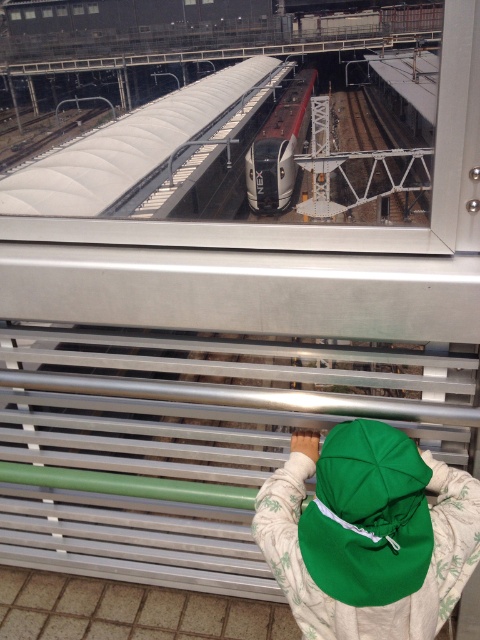
You are standing inside a building looking out through a window at a train station platform. You see a green fabric cap at lower center and a silver metallic train at center. Which object is closer to you?

The green fabric cap at lower center is closer to the viewer than the silver metallic train at center.

You are a person with a height of 1.6 meters standing at the edge of the platform holding the metal railing. You want to reach the green fabric cap at lower center to pick it up. Can you do so without moving your feet? Please explain your reasoning.

The distance between you and the green fabric cap at lower center is 1.08 meters. Since the average arm length for a person of your height is about 0.7 meters, you may not be able to reach it without moving your feet.